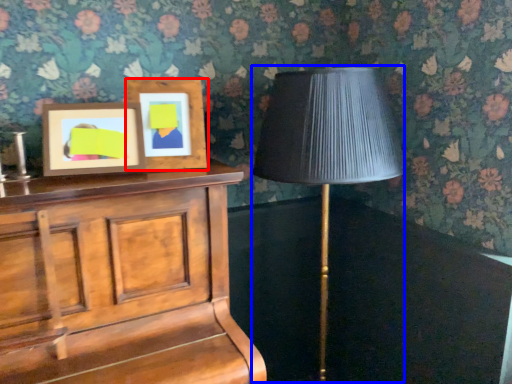
Question: Among these objects, which one is nearest to the camera, picture frame (highlighted by a red box) or table lamp (highlighted by a blue box)?

Choices:
 (A) picture frame
 (B) table lamp

Answer: (B)